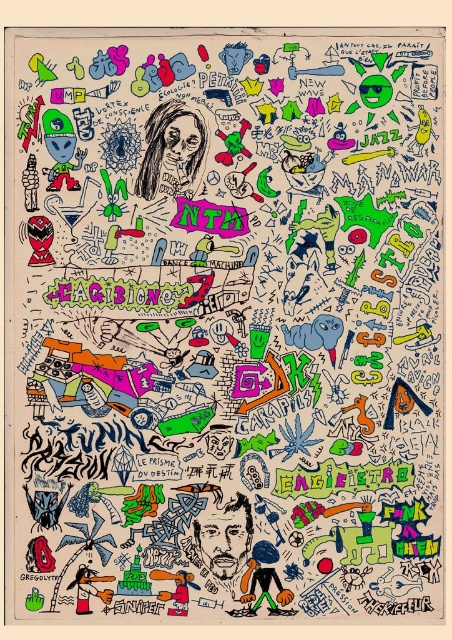
Question: Is charcoal sketch of person at upper left to the left of shaggy hair at center from the viewer's perspective?

Choices:
 (A) no
 (B) yes

Answer: (B)

Question: Which object is farther from the camera taking this photo?

Choices:
 (A) charcoal sketch of person at upper left
 (B) shaggy hair at center

Answer: (A)

Question: Which point appears farthest from the camera in this image?

Choices:
 (A) click(191, 160)
 (B) click(226, 550)

Answer: (A)

Question: Does charcoal sketch of person at upper left appear on the left side of shaggy hair at center?

Choices:
 (A) no
 (B) yes

Answer: (B)

Question: Does charcoal sketch of person at upper left appear over shaggy hair at center?

Choices:
 (A) yes
 (B) no

Answer: (A)

Question: Among these points, which one is farthest from the camera?

Choices:
 (A) (231, 566)
 (B) (155, 125)

Answer: (B)